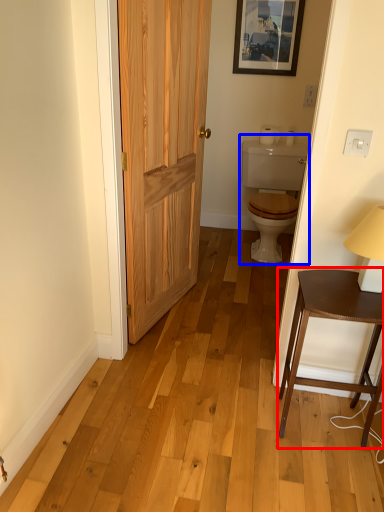
Question: Which of the following is the farthest to the observer, table (highlighted by a red box) or sink (highlighted by a blue box)?

Choices:
 (A) table
 (B) sink

Answer: (B)